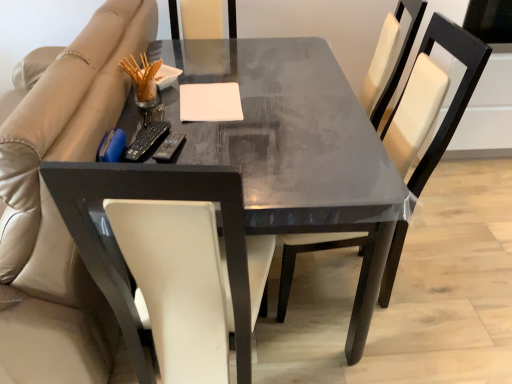
Locate an element on the screen. This screenshot has height=384, width=512. free spot to the right of black plastic remote at left is located at coordinates (211, 142).